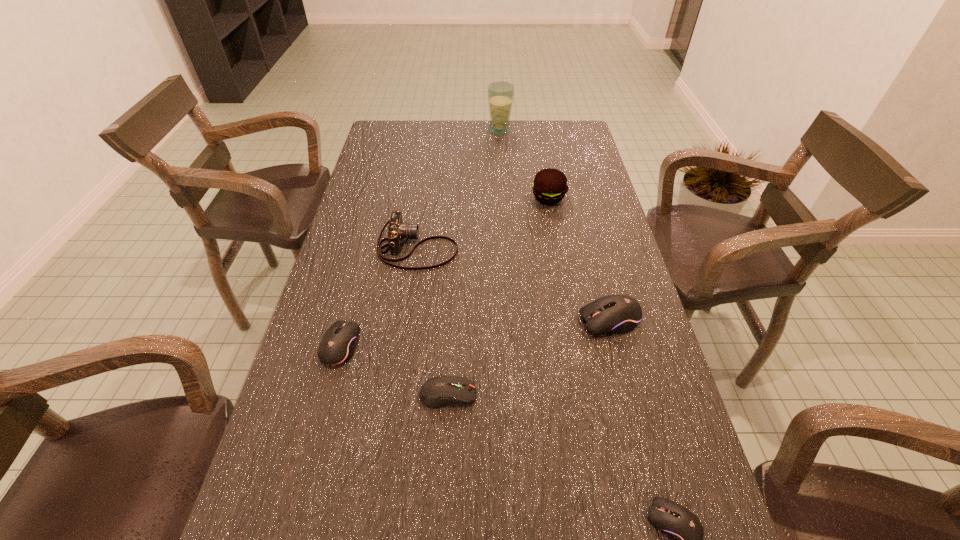
This screenshot has width=960, height=540. In order to click on dark computer equipment in this screenshot , I will do `click(437, 392)`.

What are the coordinates of `vacant space located 0.230m on the left of the blue glass` in the screenshot? It's located at (428, 130).

In order to click on blank space located 0.270m on the front of the patty in this screenshot , I will do `click(562, 269)`.

Identify the location of vacant space situated on the front-facing side of the fifth nearest object. (528, 247).

Where is `free region located 0.110m on the left of the biggest black computer mouse`? free region located 0.110m on the left of the biggest black computer mouse is located at coordinates (533, 320).

At what (x,y) coordinates should I click in order to perform the action: click on free point located 0.320m on the front of the fifth tallest object. Please return your answer as a coordinate pair (x, y). The height and width of the screenshot is (540, 960). Looking at the image, I should click on (291, 531).

The width and height of the screenshot is (960, 540). I want to click on vacant space located 0.240m on the button of the third computer mouse from right to left, so click(590, 394).

You are a GUI agent. You are given a task and a screenshot of the screen. Output one action in this format:
    pyautogui.click(x=<x>, y=<y>)
    Task: Click on the object present at the far edge
    This screenshot has height=540, width=960.
    Given the screenshot: What is the action you would take?
    pyautogui.click(x=500, y=94)

Locate an element on the screen. The image size is (960, 540). camera that is at the left edge is located at coordinates (397, 231).

Find the location of `computer mouse located at the left edge`. computer mouse located at the left edge is located at coordinates (338, 344).